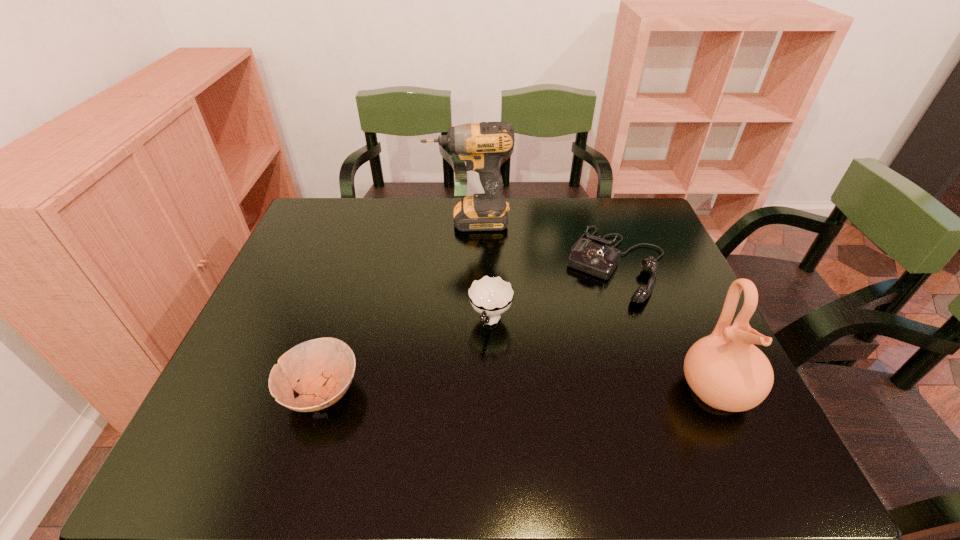
Identify the location of bowl. coord(325,367).

This screenshot has width=960, height=540. I want to click on the shortest object, so click(325, 367).

Find the location of `pottery`. pottery is located at coordinates (725, 370).

Find the location of a particular element. cup is located at coordinates (490, 296).

Find the location of a particular element. telephone is located at coordinates (594, 257).

The height and width of the screenshot is (540, 960). Identify the location of the tallest object. (481, 145).

Where is `free space located on the left of the leftmost object`? This screenshot has width=960, height=540. free space located on the left of the leftmost object is located at coordinates (253, 392).

The width and height of the screenshot is (960, 540). Find the location of `vacant point located 0.100m on the side of the cup with the handle`. vacant point located 0.100m on the side of the cup with the handle is located at coordinates (474, 376).

This screenshot has width=960, height=540. What are the coordinates of `free spot located on the side of the cup with the handle` in the screenshot? It's located at (479, 362).

The width and height of the screenshot is (960, 540). I want to click on vacant space situated on the side of the cup with the handle, so click(x=473, y=380).